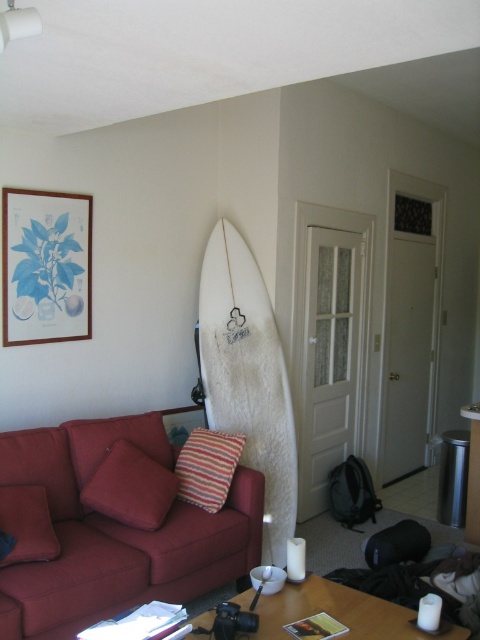
Question: Does matte red couch at lower left come in front of velvet red pillow at left?

Choices:
 (A) yes
 (B) no

Answer: (A)

Question: Which object is farther from the camera taking this photo?

Choices:
 (A) striped fabric pillow at center
 (B) striped fabric pillow at left
 (C) velvet red pillow at left
 (D) white fuzzy surfboard at center

Answer: (D)

Question: Does white fuzzy surfboard at center appear over wooden framed print at upper left?

Choices:
 (A) yes
 (B) no

Answer: (B)

Question: Based on their relative distances, which object is farther from the matte red couch at lower left?

Choices:
 (A) white glossy table at lower center
 (B) velvet red pillow at left
 (C) striped fabric pillow at center
 (D) white fuzzy surfboard at center

Answer: (D)

Question: Which point is farther from the camera taking this photo?

Choices:
 (A) (17, 560)
 (B) (218, 410)
 (C) (294, 609)

Answer: (B)

Question: Can you confirm if white fuzzy surfboard at center is positioned to the left of velvet red pillow at left?

Choices:
 (A) yes
 (B) no

Answer: (B)